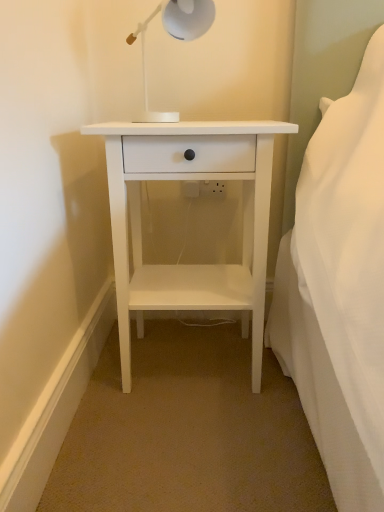
Question: Would you say white matte nightstand at center is a long distance from white plastic lamp at upper center?

Choices:
 (A) yes
 (B) no

Answer: (B)

Question: Does white matte nightstand at center have a lesser width compared to white plastic lamp at upper center?

Choices:
 (A) no
 (B) yes

Answer: (A)

Question: Is the surface of white matte nightstand at center in direct contact with white plastic lamp at upper center?

Choices:
 (A) yes
 (B) no

Answer: (B)

Question: Is white matte nightstand at center wider than white plastic lamp at upper center?

Choices:
 (A) no
 (B) yes

Answer: (B)

Question: From a real-world perspective, is white matte nightstand at center over white plastic lamp at upper center?

Choices:
 (A) no
 (B) yes

Answer: (A)

Question: Is white matte nightstand at center in front of white plastic lamp at upper center?

Choices:
 (A) no
 (B) yes

Answer: (A)

Question: Is white plastic lamp at upper center further to the viewer compared to white matte nightstand at center?

Choices:
 (A) no
 (B) yes

Answer: (A)

Question: From the image's perspective, is white plastic lamp at upper center located beneath white matte nightstand at center?

Choices:
 (A) yes
 (B) no

Answer: (B)

Question: Is white plastic lamp at upper center shorter than white matte nightstand at center?

Choices:
 (A) no
 (B) yes

Answer: (B)

Question: Is white plastic lamp at upper center not within white matte nightstand at center?

Choices:
 (A) yes
 (B) no

Answer: (A)

Question: Could white matte nightstand at center be considered to be inside white plastic lamp at upper center?

Choices:
 (A) no
 (B) yes

Answer: (A)

Question: From a real-world perspective, is white plastic lamp at upper center physically below white matte nightstand at center?

Choices:
 (A) yes
 (B) no

Answer: (B)

Question: Does point (178, 119) appear closer or farther from the camera than point (122, 348)?

Choices:
 (A) closer
 (B) farther

Answer: (A)